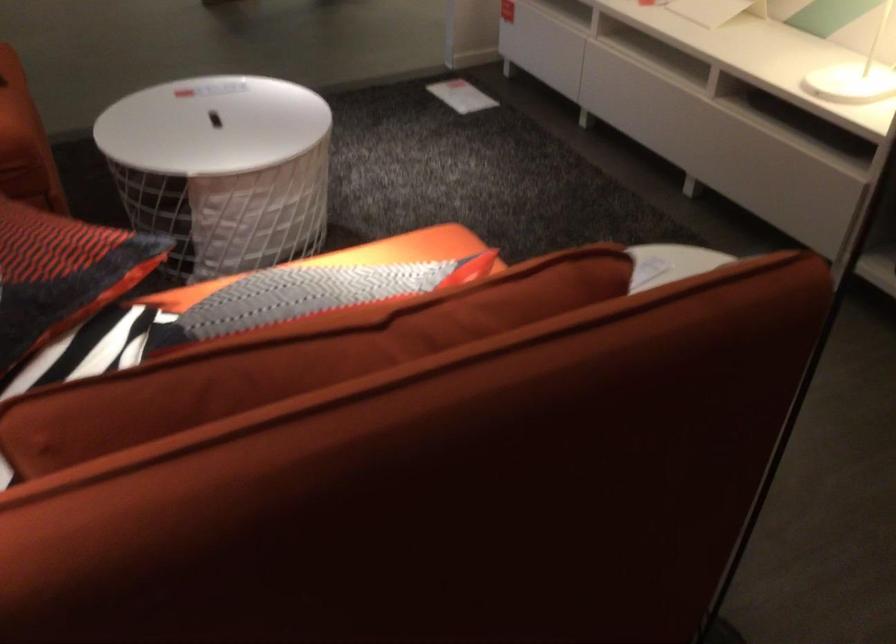
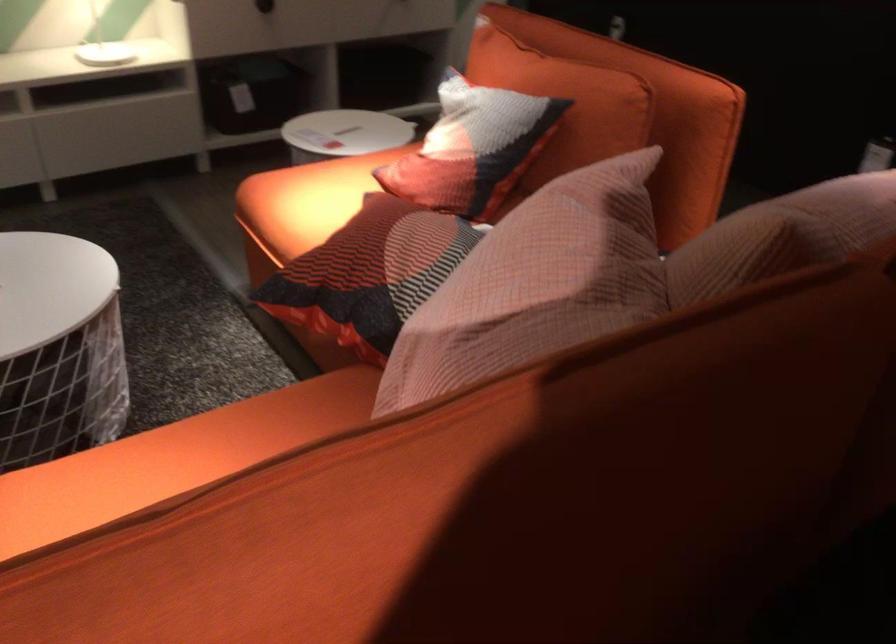
In the second image, find the point that corresponds to pixel 356 247 in the first image.

(306, 200)